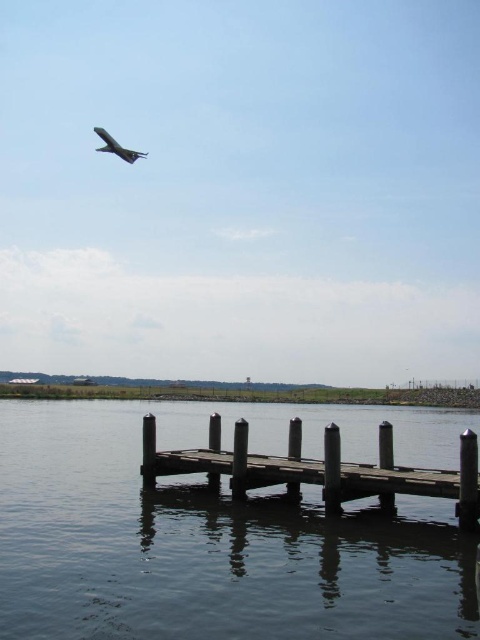
Who is positioned more to the left, smooth wooden dock at lower center or metallic silver airplane at upper left?

Positioned to the left is metallic silver airplane at upper left.

Does point (276, 520) come farther from viewer compared to point (103, 138)?

Yes, point (276, 520) is farther from viewer.

Where is `smooth wooden dock at lower center`? smooth wooden dock at lower center is located at coordinates (220, 531).

Can you confirm if wooden dock at center is smaller than metallic silver airplane at upper left?

Actually, wooden dock at center might be larger than metallic silver airplane at upper left.

Between point (471, 472) and point (132, 156), which one is positioned in front?

Point (471, 472) is in front.

Locate an element on the screen. The height and width of the screenshot is (640, 480). wooden dock at center is located at coordinates (317, 468).

Does point (430, 580) come closer to viewer compared to point (343, 472)?

Yes, point (430, 580) is closer to viewer.

Identify the location of smooth wooden dock at lower center. click(220, 531).